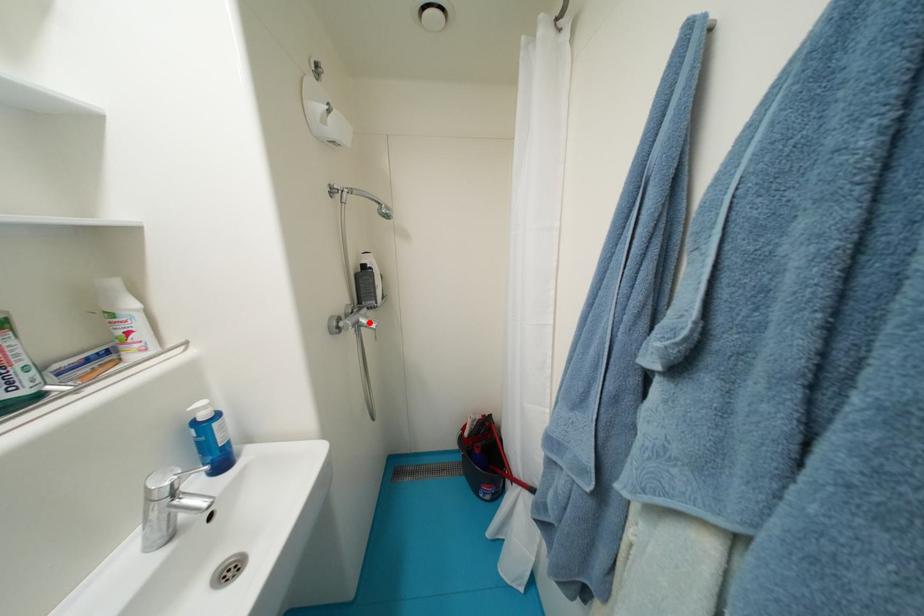
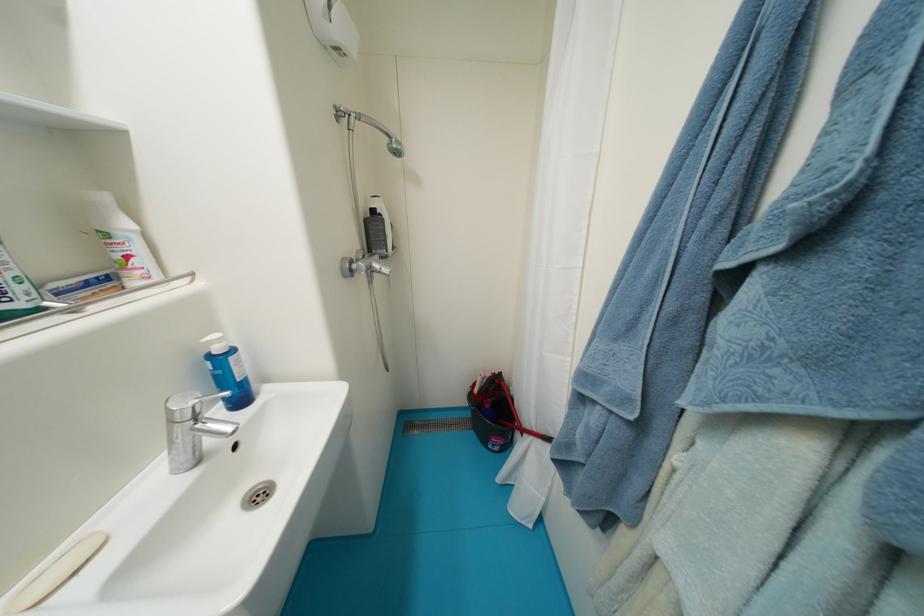
Question: I am providing you with two images of the same scene from different viewpoints. A red point is marked on the first image. Can you still see the location of the red point in image 2?

Choices:
 (A) Yes
 (B) No

Answer: (A)